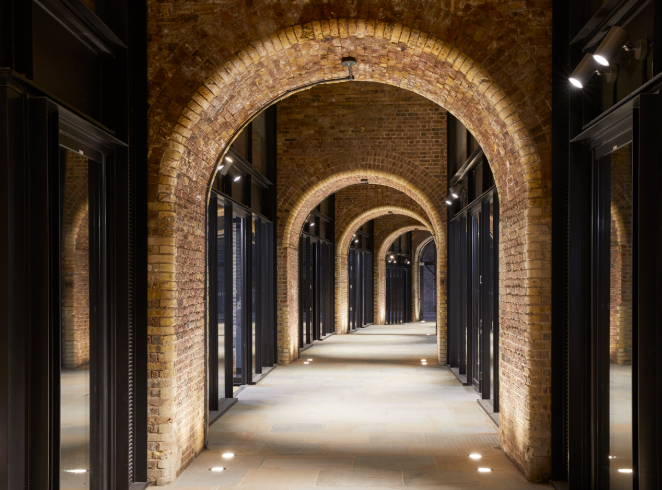
This screenshot has height=490, width=662. What are the coordinates of `door` in the screenshot? It's located at (236, 270), (310, 293), (396, 307).